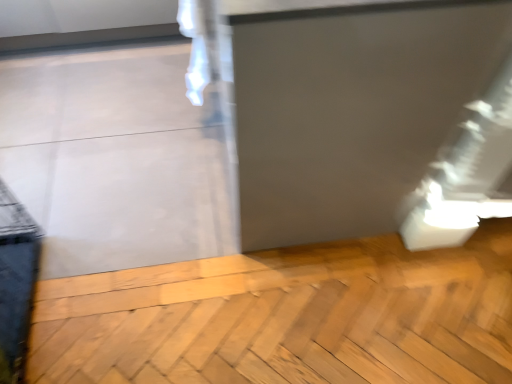
Locate an element on the screen. This screenshot has width=512, height=384. vacant space situated on the left part of matte gray screen door at center is located at coordinates (164, 180).